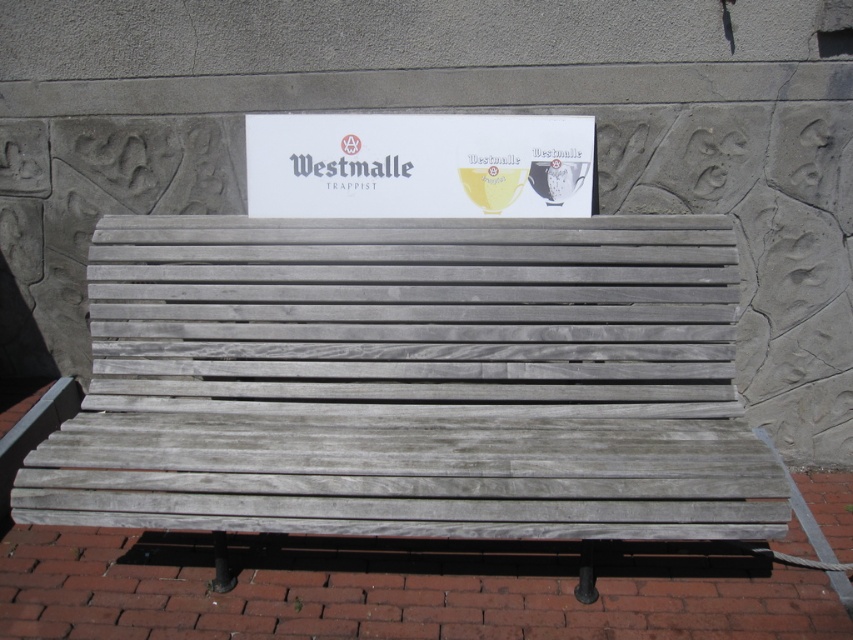
Which of these two, weathered wood bench at center or white paper sign at center, stands taller?

With more height is weathered wood bench at center.

This screenshot has width=853, height=640. I want to click on weathered wood bench at center, so click(410, 381).